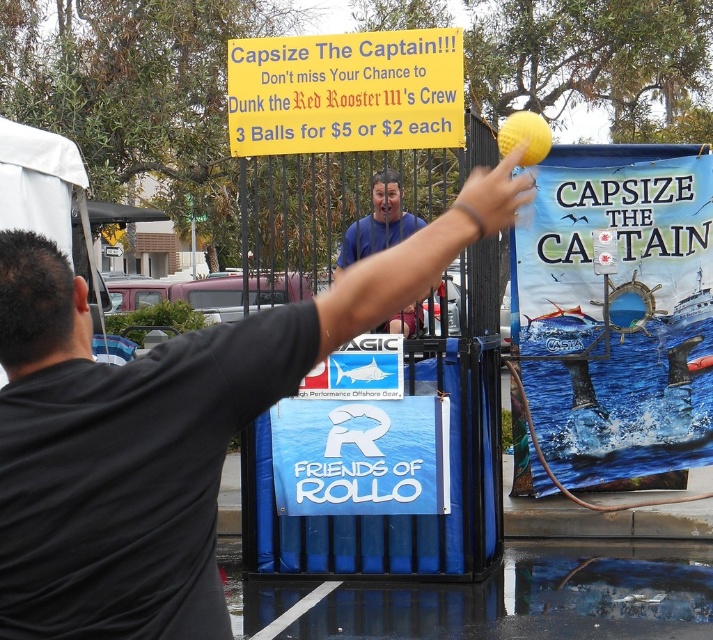
In the scene shown: Which is more to the right, yellow paper sign at upper center or blue shirt at center?

Positioned to the right is blue shirt at center.

Does point (410, 51) come farther from viewer compared to point (364, 216)?

No, (410, 51) is in front of (364, 216).

Is point (292, 109) more distant than point (371, 176)?

No, it is in front of (371, 176).

You are a GUI agent. You are given a task and a screenshot of the screen. Output one action in this format:
    pyautogui.click(x=<x>, y=<y>)
    Task: Click on the yellow paper sign at upper center
    The height and width of the screenshot is (640, 713).
    Given the screenshot: What is the action you would take?
    pyautogui.click(x=344, y=92)

Can you confirm if black matte shirt at upper center is thinner than yellow paper sign at upper center?

Yes, black matte shirt at upper center is thinner than yellow paper sign at upper center.

Where is `black matte shirt at upper center`? Image resolution: width=713 pixels, height=640 pixels. black matte shirt at upper center is located at coordinates (163, 428).

Can you confirm if black matte shirt at upper center is positioned below blue shirt at center?

Yes, black matte shirt at upper center is below blue shirt at center.

Measure the distance between point (x=222, y=332) and camera.

Point (x=222, y=332) is 3.15 meters away from camera.

The image size is (713, 640). Identify the location of black matte shirt at upper center. (163, 428).